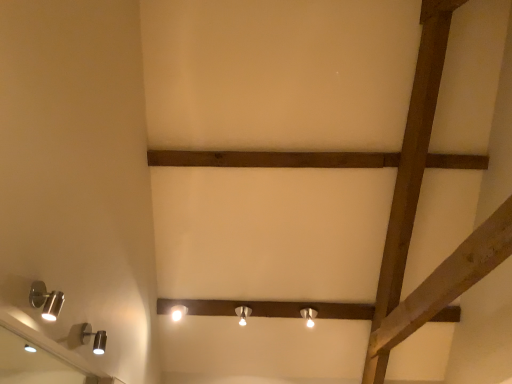
Question: From their relative heights in the image, would you say brown wooden plank at center is taller or shorter than matte silver lamp at center, which is the second lamp in right-to-left order?

Choices:
 (A) short
 (B) tall

Answer: (A)

Question: In the image, is brown wooden plank at center on the left side or the right side of matte silver lamp at center, marked as the 5th lamp in a front-to-back arrangement?

Choices:
 (A) left
 (B) right

Answer: (B)

Question: Considering the real-world distances, which object is farthest from the satin silver spotlight at lower left, arranged as the fourth lamp when ordered from the bottom?

Choices:
 (A) white glossy lamp at center, positioned as the third lamp in right-to-left order
 (B) matte silver lamp at center, which is the second lamp in right-to-left order
 (C) matte silver lamp at center, placed as the 5th lamp when sorted from top to bottom
 (D) satin silver spotlight at lower left, marked as the first lamp in a front-to-back arrangement
 (E) brown wooden plank at center

Answer: (C)

Question: Which object is the closest to the brown wooden plank at center?

Choices:
 (A) silver metallic mirror at lower left
 (B) satin silver spotlight at lower left, the second lamp from the left
 (C) matte silver lamp at center, which is the first lamp from right to left
 (D) white glossy lamp at center, which appears as the third lamp when ordered from the bottom
 (E) matte silver lamp at center, the fourth lamp from the left

Answer: (C)